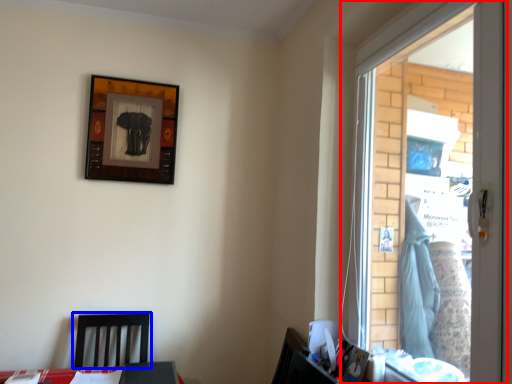
Question: Which of the following is the farthest to the observer, window (highlighted by a red box) or furniture (highlighted by a blue box)?

Choices:
 (A) window
 (B) furniture

Answer: (B)